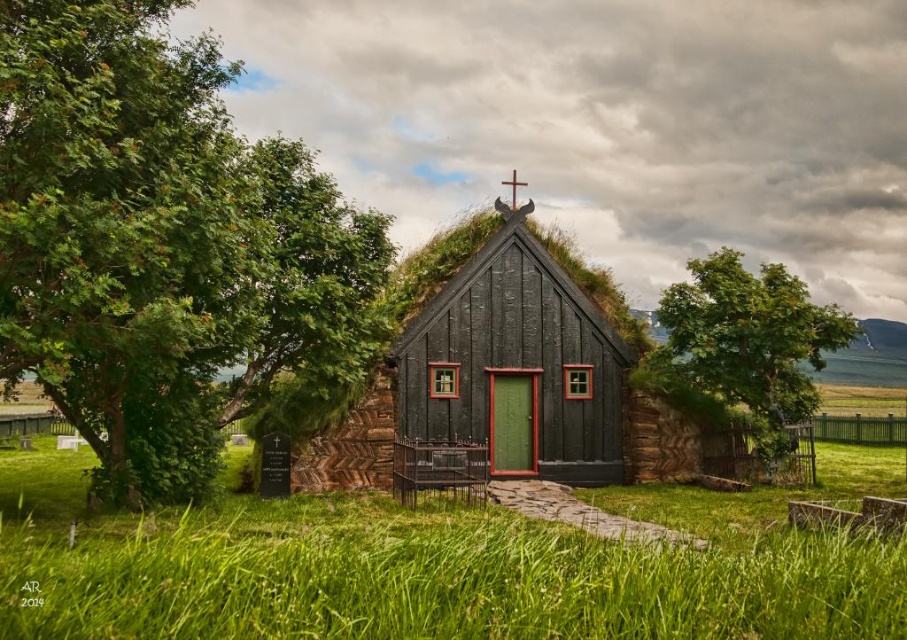
You are standing at the entrance of the traditional Icelandic turf church and want to take a photo that includes both the green leafy tree at left and the green grass at center. Which object will appear taller in the photo?

The green leafy tree at left will appear taller in the photo because it has a greater height compared to the green grass at center.

You are an architect designing a new garden for the Icelandic turf church. You have a limited budget and must choose between placing a wider green leafy tree at left or a wider green grass at center. Based on the current scene, which existing element is narrower and can be replaced to save space?

The green leafy tree at left has a lesser width compared to the green grass at center, so replacing the green leafy tree at left would save space since it is narrower.